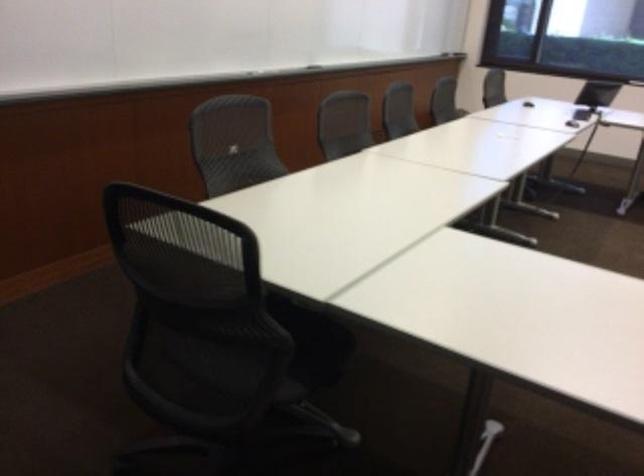
You are a GUI agent. You are given a task and a screenshot of the screen. Output one action in this format:
    pyautogui.click(x=<x>, y=<y>)
    Task: Click on the chair sitting surface
    Image resolution: width=644 pixels, height=476 pixels.
    Given the screenshot: What is the action you would take?
    pyautogui.click(x=314, y=341)